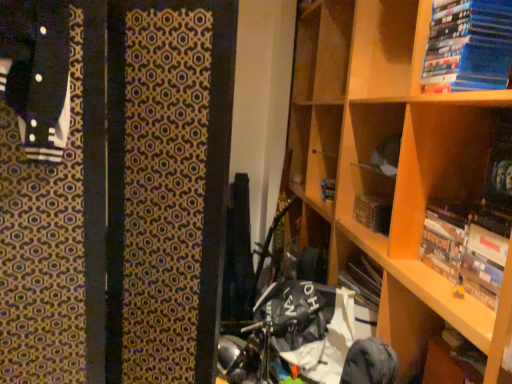
What do you see at coordinates (464, 251) in the screenshot? I see `hardcover book at upper right, the first book in the bottom-to-top sequence` at bounding box center [464, 251].

At what (x,y) coordinates should I click in order to perform the action: click on blue matte book at upper right, marked as the 1th book in a top-to-bottom arrangement. Please return your answer as a coordinate pair (x, y). This screenshot has height=384, width=512. Looking at the image, I should click on (469, 45).

The height and width of the screenshot is (384, 512). Describe the element at coordinates (373, 213) in the screenshot. I see `hardcover book at center` at that location.

Where is `hardcover book at upper right, the first book in the bottom-to-top sequence`? hardcover book at upper right, the first book in the bottom-to-top sequence is located at coordinates (x=464, y=251).

Is wooden bookshelf at upper right surrounded by hardcover book at center?

No, wooden bookshelf at upper right is not a part of hardcover book at center.

Is point (369, 220) more distant than point (399, 329)?

Yes, it is.

Is hardcover book at center further to the viewer compared to wooden bookshelf at upper right?

Yes, hardcover book at center is behind wooden bookshelf at upper right.

Is the surface of hardcover book at upper right, positioned as the second book in top-to-bottom order, in direct contact with blue matte book at upper right, marked as the 1th book in a top-to-bottom arrangement?

There is a gap between hardcover book at upper right, positioned as the second book in top-to-bottom order, and blue matte book at upper right, marked as the 1th book in a top-to-bottom arrangement.

From the image's perspective, does hardcover book at upper right, the first book in the bottom-to-top sequence, appear lower than blue matte book at upper right, marked as the 1th book in a top-to-bottom arrangement?

Yes.

Is hardcover book at upper right, the first book in the bottom-to-top sequence, inside or outside of blue matte book at upper right, marked as the 1th book in a top-to-bottom arrangement?

hardcover book at upper right, the first book in the bottom-to-top sequence, is not enclosed by blue matte book at upper right, marked as the 1th book in a top-to-bottom arrangement.

How many degrees apart are the facing directions of hardcover book at upper right, positioned as the second book in top-to-bottom order, and blue matte book at upper right, marked as the 1th book in a top-to-bottom arrangement?

hardcover book at upper right, positioned as the second book in top-to-bottom order, and blue matte book at upper right, marked as the 1th book in a top-to-bottom arrangement, are facing 0.000725 degrees away from each other.

Relative to wooden bookshelf at upper right, is blue matte book at upper right, acting as the second book starting from the bottom, in front or behind?

Clearly, blue matte book at upper right, acting as the second book starting from the bottom, is behind wooden bookshelf at upper right.

Which object is positioned more to the right, blue matte book at upper right, marked as the 1th book in a top-to-bottom arrangement, or wooden bookshelf at upper right?

Positioned to the right is blue matte book at upper right, marked as the 1th book in a top-to-bottom arrangement.

From the picture: Can you tell me how much blue matte book at upper right, acting as the second book starting from the bottom, and wooden bookshelf at upper right differ in facing direction?

The angular difference between blue matte book at upper right, acting as the second book starting from the bottom, and wooden bookshelf at upper right is 0.329 degrees.

Is wooden bookshelf at upper right at the back of blue matte book at upper right, marked as the 1th book in a top-to-bottom arrangement?

Yes, blue matte book at upper right, marked as the 1th book in a top-to-bottom arrangement, is positioned with its back facing wooden bookshelf at upper right.

Would you say hardcover book at upper right, positioned as the second book in top-to-bottom order, is inside or outside wooden bookshelf at upper right?

hardcover book at upper right, positioned as the second book in top-to-bottom order, is contained in wooden bookshelf at upper right.

Is hardcover book at upper right, the first book in the bottom-to-top sequence, bigger or smaller than wooden bookshelf at upper right?

In the image, hardcover book at upper right, the first book in the bottom-to-top sequence, appears to be smaller than wooden bookshelf at upper right.

From the picture: Between hardcover book at upper right, positioned as the second book in top-to-bottom order, and wooden bookshelf at upper right, which one has larger width?

Wider between the two is wooden bookshelf at upper right.

Are wooden bookshelf at upper right and blue matte book at upper right, acting as the second book starting from the bottom, beside each other?

wooden bookshelf at upper right and blue matte book at upper right, acting as the second book starting from the bottom, are not in contact.

Considering the relative sizes of wooden bookshelf at upper right and blue matte book at upper right, acting as the second book starting from the bottom, in the image provided, is wooden bookshelf at upper right bigger than blue matte book at upper right, acting as the second book starting from the bottom,?

Correct, wooden bookshelf at upper right is larger in size than blue matte book at upper right, acting as the second book starting from the bottom.

Is wooden bookshelf at upper right in front of or behind blue matte book at upper right, marked as the 1th book in a top-to-bottom arrangement, in the image?

Visually, wooden bookshelf at upper right is located in front of blue matte book at upper right, marked as the 1th book in a top-to-bottom arrangement.

In the scene shown: How different are the orientations of wooden bookshelf at upper right and hardcover book at upper right, positioned as the second book in top-to-bottom order, in degrees?

They differ by 0.328 degrees in their facing directions.

How far apart are wooden bookshelf at upper right and hardcover book at upper right, the first book in the bottom-to-top sequence?

wooden bookshelf at upper right is 11.61 inches from hardcover book at upper right, the first book in the bottom-to-top sequence.

Choose the correct answer: Is wooden bookshelf at upper right inside hardcover book at upper right, the first book in the bottom-to-top sequence, or outside it?

wooden bookshelf at upper right is spatially situated outside hardcover book at upper right, the first book in the bottom-to-top sequence.

Considering the relative sizes of wooden bookshelf at upper right and hardcover book at upper right, positioned as the second book in top-to-bottom order, in the image provided, is wooden bookshelf at upper right shorter than hardcover book at upper right, positioned as the second book in top-to-bottom order,?

In fact, wooden bookshelf at upper right may be taller than hardcover book at upper right, positioned as the second book in top-to-bottom order.

In terms of size, does hardcover book at upper right, the first book in the bottom-to-top sequence, appear bigger or smaller than hardcover book at center?

hardcover book at upper right, the first book in the bottom-to-top sequence, is bigger than hardcover book at center.

Are hardcover book at upper right, positioned as the second book in top-to-bottom order, and hardcover book at center located far from each other?

hardcover book at upper right, positioned as the second book in top-to-bottom order, is near hardcover book at center, not far away.

In the scene shown: Is hardcover book at upper right, positioned as the second book in top-to-bottom order, aimed at hardcover book at center?

No, hardcover book at upper right, positioned as the second book in top-to-bottom order, is not turned towards hardcover book at center.

From a real-world perspective, which object rests below the other?

From a 3D spatial view, hardcover book at center is below.

Image resolution: width=512 pixels, height=384 pixels. Identify the location of paperback book above the wooden bookshelf at upper right (from the image's perspective). (373, 213).

In order to click on book located underneath the blue matte book at upper right, acting as the second book starting from the bottom (from a real-world perspective) in this screenshot , I will do `click(464, 251)`.

Looking at the image, which one is located closer to hardcover book at upper right, the first book in the bottom-to-top sequence, wooden bookshelf at upper right or hardcover book at center?

wooden bookshelf at upper right is positioned closer to the anchor hardcover book at upper right, the first book in the bottom-to-top sequence.

Which object lies further to the anchor point wooden bookshelf at upper right, blue matte book at upper right, marked as the 1th book in a top-to-bottom arrangement, or hardcover book at center?

hardcover book at center.

Estimate the real-world distances between objects in this image. Which object is closer to blue matte book at upper right, acting as the second book starting from the bottom, hardcover book at center or wooden bookshelf at upper right?

wooden bookshelf at upper right is positioned closer to the anchor blue matte book at upper right, acting as the second book starting from the bottom.

When comparing their distances from hardcover book at center, does blue matte book at upper right, acting as the second book starting from the bottom, or wooden bookshelf at upper right seem closer?

wooden bookshelf at upper right is positioned closer to the anchor hardcover book at center.

When comparing their distances from wooden bookshelf at upper right, does hardcover book at upper right, the first book in the bottom-to-top sequence, or hardcover book at center seem closer?

hardcover book at upper right, the first book in the bottom-to-top sequence, is closer to wooden bookshelf at upper right.

From the image, which object appears to be nearer to hardcover book at upper right, the first book in the bottom-to-top sequence, hardcover book at center or blue matte book at upper right, acting as the second book starting from the bottom?

Among the two, blue matte book at upper right, acting as the second book starting from the bottom, is located nearer to hardcover book at upper right, the first book in the bottom-to-top sequence.

Considering their positions, is hardcover book at upper right, the first book in the bottom-to-top sequence, positioned further to blue matte book at upper right, acting as the second book starting from the bottom, than wooden bookshelf at upper right?

hardcover book at upper right, the first book in the bottom-to-top sequence, lies further to blue matte book at upper right, acting as the second book starting from the bottom, than the other object.

Estimate the real-world distances between objects in this image. Which object is closer to hardcover book at center, wooden bookshelf at upper right or hardcover book at upper right, the first book in the bottom-to-top sequence?

wooden bookshelf at upper right lies closer to hardcover book at center than the other object.

This screenshot has width=512, height=384. Identify the location of book between blue matte book at upper right, acting as the second book starting from the bottom, and wooden bookshelf at upper right from top to bottom. (464, 251).

Find the location of a particular element. The image size is (512, 384). book between blue matte book at upper right, marked as the 1th book in a top-to-bottom arrangement, and hardcover book at center in the front-back direction is located at coordinates (464, 251).